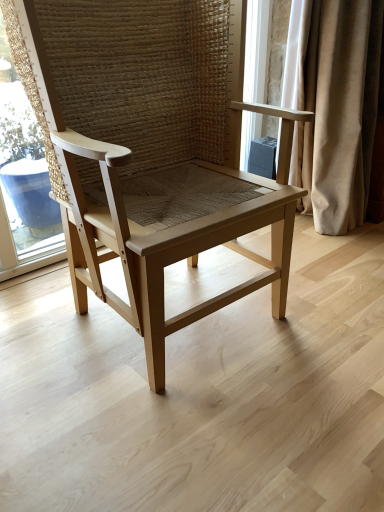
Question: Looking at their shapes, would you say light wood chair at center is wider or thinner than beige fabric curtain at right?

Choices:
 (A) thin
 (B) wide

Answer: (B)

Question: Relative to beige fabric curtain at right, is light wood chair at center in front or behind?

Choices:
 (A) behind
 (B) front

Answer: (B)

Question: In terms of height, does light wood chair at center look taller or shorter compared to beige fabric curtain at right?

Choices:
 (A) tall
 (B) short

Answer: (B)

Question: Looking at the image, does beige fabric curtain at right seem bigger or smaller compared to light wood chair at center?

Choices:
 (A) big
 (B) small

Answer: (B)

Question: Is beige fabric curtain at right taller or shorter than light wood chair at center?

Choices:
 (A) tall
 (B) short

Answer: (A)

Question: In the image, is beige fabric curtain at right positioned in front of or behind light wood chair at center?

Choices:
 (A) behind
 (B) front

Answer: (A)

Question: Is beige fabric curtain at right to the left or to the right of light wood chair at center in the image?

Choices:
 (A) right
 (B) left

Answer: (A)